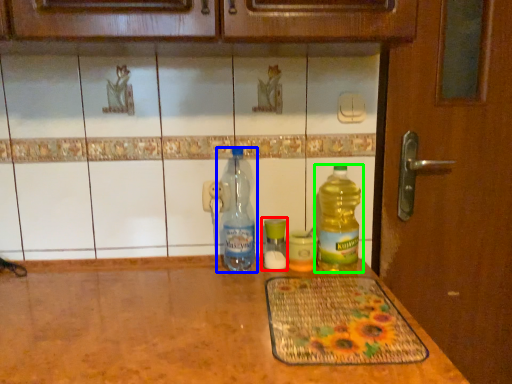
Question: Which object is positioned farthest from bottle (highlighted by a red box)? Select from bottle (highlighted by a blue box) and bottle (highlighted by a green box).

Choices:
 (A) bottle
 (B) bottle

Answer: (B)